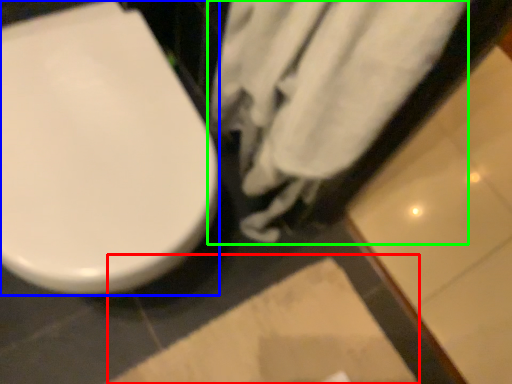
Question: Which object is positioned closest to square (highlighted by a red box)? Select from toilet (highlighted by a blue box) and bath towel (highlighted by a green box).

Choices:
 (A) toilet
 (B) bath towel

Answer: (B)